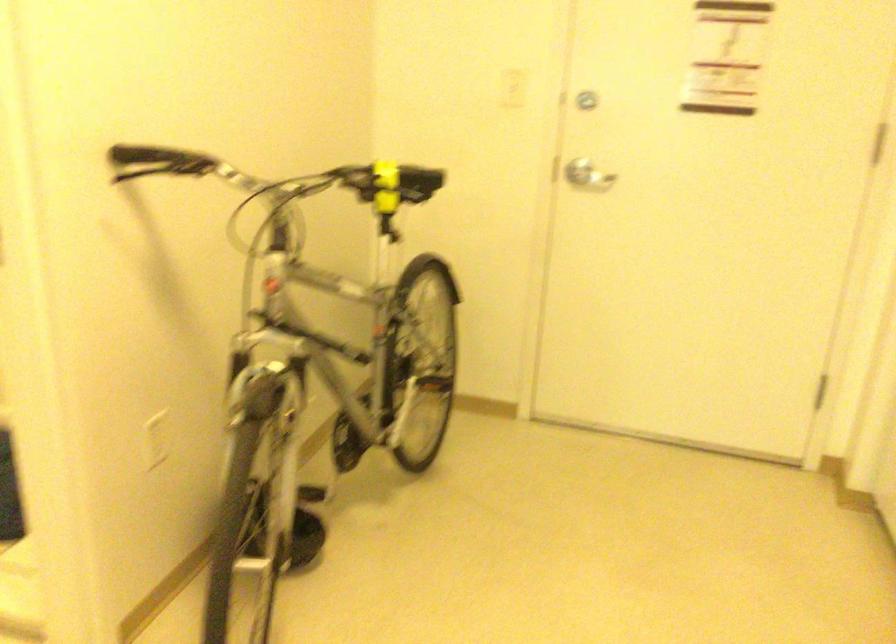
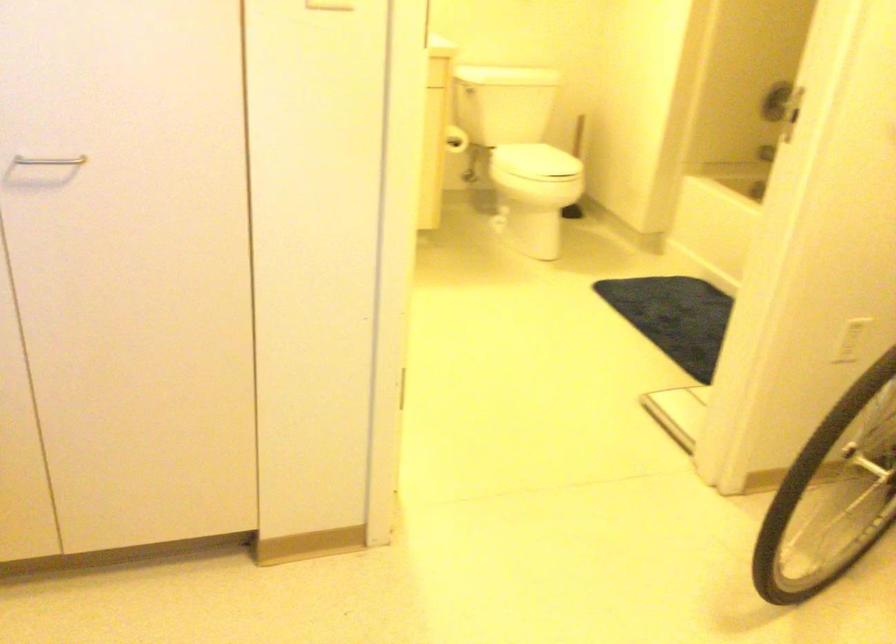
Question: The first image is from the beginning of the video and the second image is from the end. How did the camera likely rotate when shooting the video?

Choices:
 (A) Left
 (B) Right
 (C) Up
 (D) Down

Answer: (A)